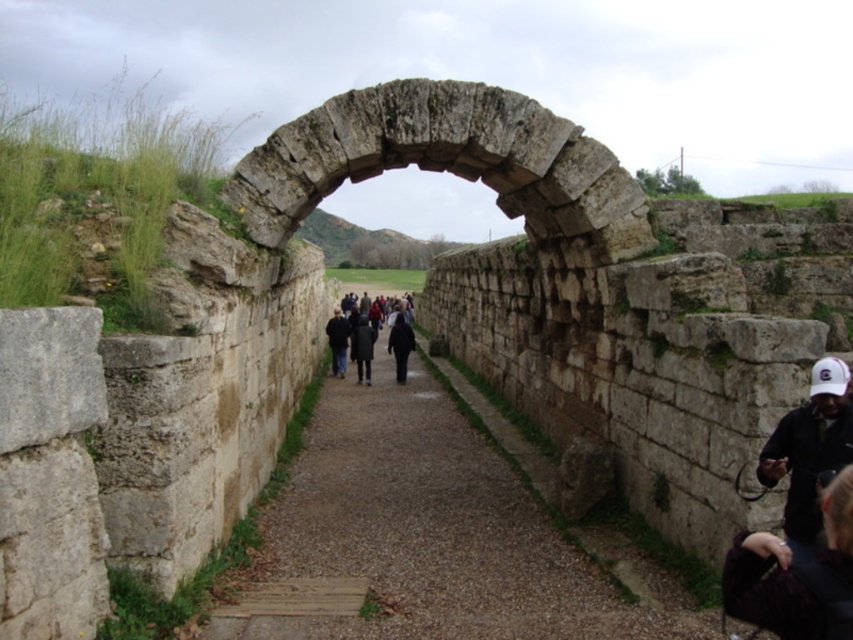
Question: Can you confirm if dark purple jacket at lower right is wider than black matte jacket at center?

Choices:
 (A) yes
 (B) no

Answer: (B)

Question: Where is brown stone path at center located in relation to black matte jacket at center in the image?

Choices:
 (A) right
 (B) left

Answer: (A)

Question: Is dark gray coat at center closer to camera compared to dark blue jacket at center?

Choices:
 (A) no
 (B) yes

Answer: (B)

Question: Considering the real-world distances, which object is closest to the black fabric cap at right?

Choices:
 (A) dark gray coat at center
 (B) dark blue jacket at center
 (C) brown stone path at center

Answer: (C)

Question: Which of these objects is positioned closest to the dark gray coat at center?

Choices:
 (A) black fabric cap at right
 (B) black matte jacket at center
 (C) brown stone path at center
 (D) dark purple jacket at lower right

Answer: (B)

Question: Which point appears closest to the camera in this image?

Choices:
 (A) (338, 342)
 (B) (402, 349)
 (C) (810, 486)
 (D) (848, 627)

Answer: (D)